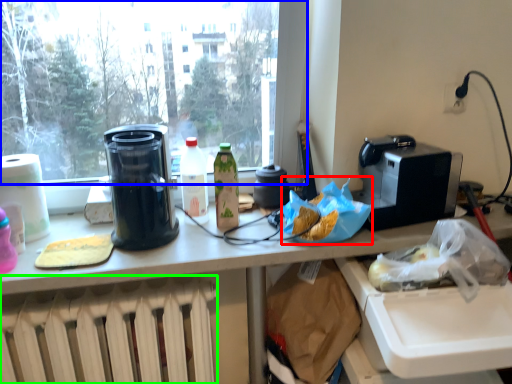
Question: Estimate the real-world distances between objects in this image. Which object is farther from food (highlighted by a red box), window (highlighted by a blue box) or heater (highlighted by a green box)?

Choices:
 (A) window
 (B) heater

Answer: (A)